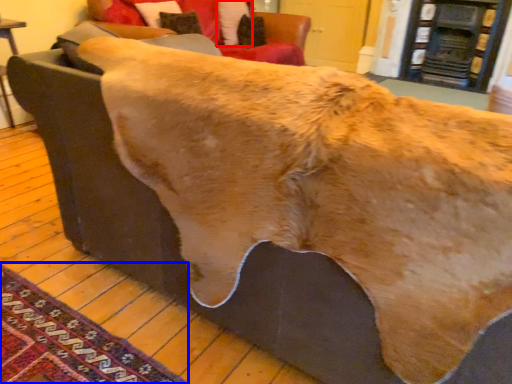
Question: Which object appears closest to the camera in this image, pillow (highlighted by a red box) or mat (highlighted by a blue box)?

Choices:
 (A) pillow
 (B) mat

Answer: (B)